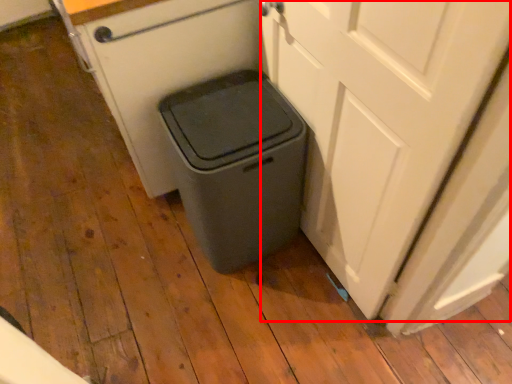
Question: Where is screen door (annotated by the red box) located in relation to waste container in the image?

Choices:
 (A) right
 (B) left

Answer: (A)